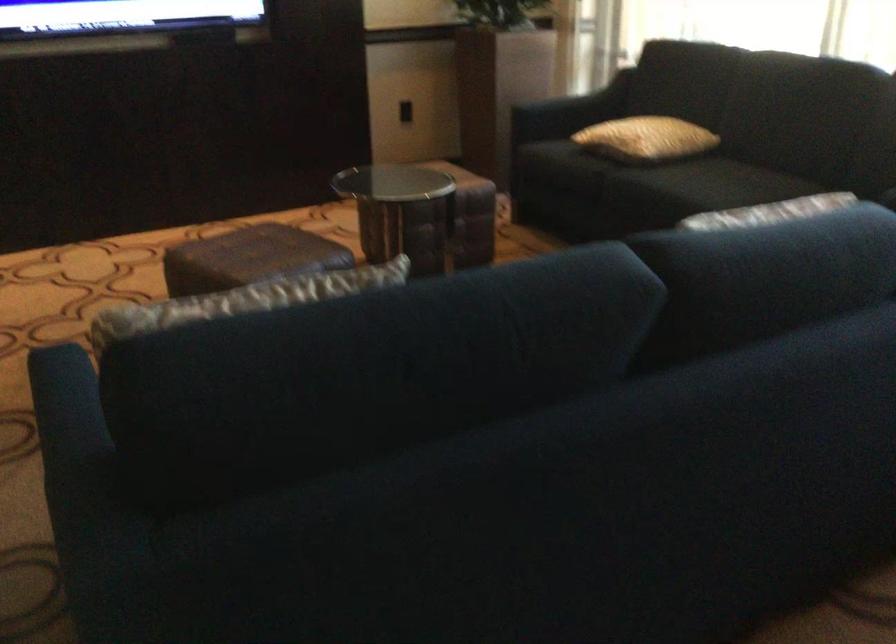
The width and height of the screenshot is (896, 644). Describe the element at coordinates (252, 298) in the screenshot. I see `the patterned pillow` at that location.